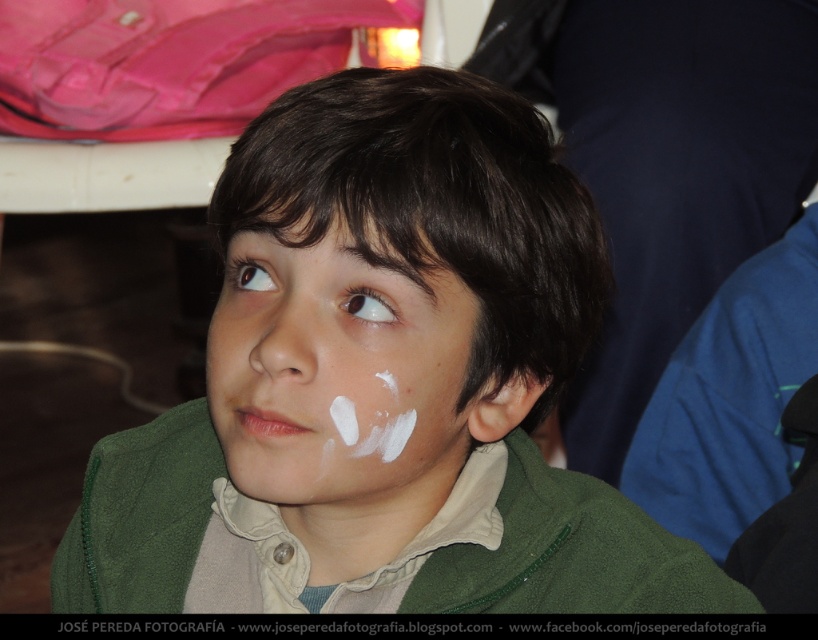
You are a photographer adjusting your camera settings to capture the boy in the image. The camera has a focus distance of 18 inches. Will the white matte forehead at upper center be in focus?

The white matte forehead at upper center is 17.85 inches away from the camera, which is within the focus distance of 18 inches. Therefore, the forehead should be in focus.

The boy in the image has two white markings on his face. One is the white matte forehead at upper center and the other is the smooth white nose at center. From the boy perspective, which white marking is on the left side of his face?

The white matte forehead at upper center is to the left of the smooth white nose at center, so from the boy perspective, the white matte forehead at upper center is on the left side of his face.